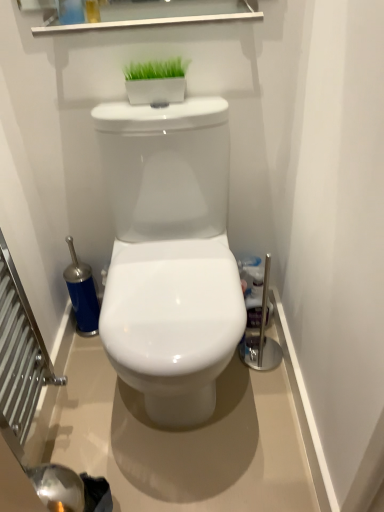
Locate an element on the screen. The width and height of the screenshot is (384, 512). brushed metal medicine cabinet at upper center is located at coordinates (158, 15).

What do you see at coordinates (158, 15) in the screenshot? Image resolution: width=384 pixels, height=512 pixels. I see `brushed metal medicine cabinet at upper center` at bounding box center [158, 15].

This screenshot has width=384, height=512. What are the coordinates of `brushed metal medicine cabinet at upper center` in the screenshot? It's located at [158, 15].